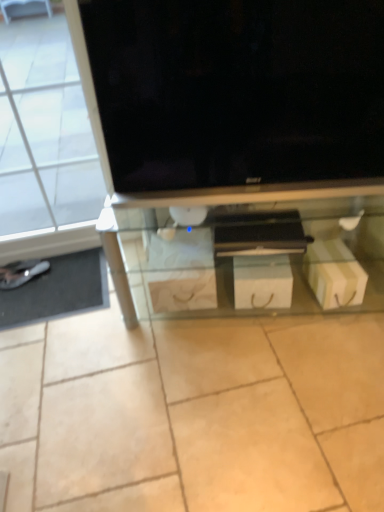
Identify the location of vacant space to the right of shiny silver shoe at lower left. (62, 272).